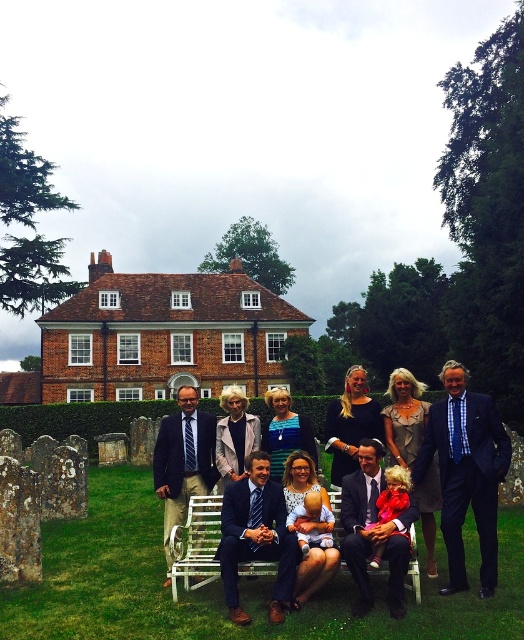
You are a photographer trying to capture a clear shot of the dark blue suit at center and the white wood bench at center. Which object should you focus on first if you want to ensure both are in focus, given that the bench is closer to you?

The dark blue suit at center is above the white wood bench at center, so you should focus on the dark blue suit at center first since it is farther away to ensure both are in focus.

You are a photographer trying to capture a group photo. You notice the dark blue suit at center and the white wood bench at center. Which object takes up more space horizontally in the image?

The dark blue suit at center takes up more horizontal space than the white wood bench at center because its width is larger than the bench.